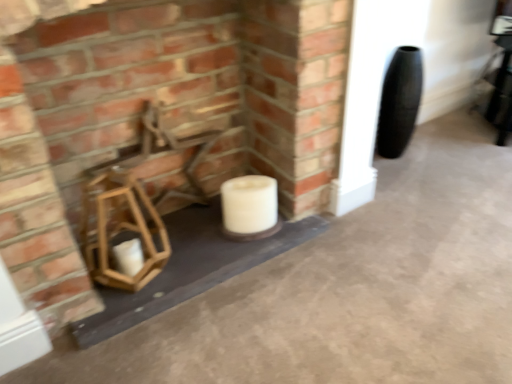
Question: Does point (332, 173) appear closer or farther from the camera than point (297, 251)?

Choices:
 (A) farther
 (B) closer

Answer: (A)

Question: In terms of size, does wooden lantern at lower left appear bigger or smaller than smooth concrete at center?

Choices:
 (A) big
 (B) small

Answer: (A)

Question: Estimate the real-world distances between objects in this image. Which object is closer to the smooth concrete at center?

Choices:
 (A) wooden chair at center
 (B) wooden lantern at lower left
 (C) white matte candle at center

Answer: (C)

Question: Which of these objects is positioned farthest from the white matte candle at center?

Choices:
 (A) smooth concrete at center
 (B) wooden lantern at lower left
 (C) wooden chair at center

Answer: (A)